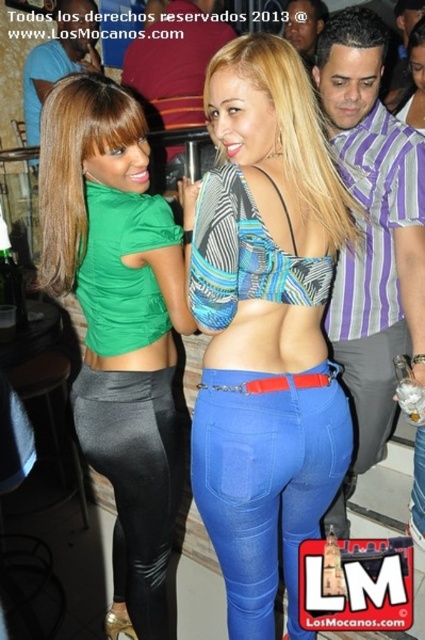
Find the location of `green matte leggings at center`. green matte leggings at center is located at coordinates (118, 324).

Image resolution: width=425 pixels, height=640 pixels. Describe the element at coordinates (118, 324) in the screenshot. I see `green matte leggings at center` at that location.

The width and height of the screenshot is (425, 640). I want to click on green matte leggings at center, so click(118, 324).

Where is `green matte leggings at center`? This screenshot has height=640, width=425. green matte leggings at center is located at coordinates (118, 324).

Does point (167, 605) come farther from viewer compared to point (359, 410)?

Yes, it is.

Identify the location of black leather leggings at lower left. Image resolution: width=425 pixels, height=640 pixels. (136, 481).

Which of these two, patterned fabric bikini top at center or black leather leggings at lower left, stands shorter?

black leather leggings at lower left

In the scene shown: Can you confirm if patterned fabric bikini top at center is positioned below black leather leggings at lower left?

Answer: No, patterned fabric bikini top at center is not below black leather leggings at lower left.

What do you see at coordinates (266, 326) in the screenshot? This screenshot has height=640, width=425. I see `patterned fabric bikini top at center` at bounding box center [266, 326].

This screenshot has height=640, width=425. I want to click on patterned fabric bikini top at center, so click(266, 326).